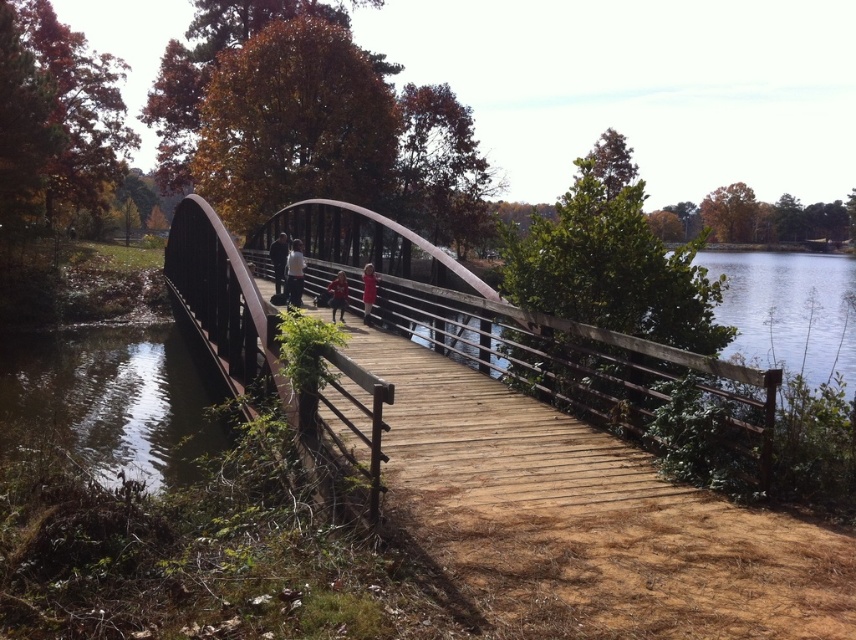
Question: Which point is closer to the camera?

Choices:
 (A) (587, 454)
 (B) (637, 380)

Answer: (A)

Question: Does wooden bridge at center appear on the left side of rusty metal bridge at center?

Choices:
 (A) yes
 (B) no

Answer: (B)

Question: Is wooden bridge at center smaller than rusty metal bridge at center?

Choices:
 (A) yes
 (B) no

Answer: (A)

Question: Which of the following is the farthest from the observer?

Choices:
 (A) (533, 417)
 (B) (485, 307)

Answer: (B)

Question: In this image, where is wooden bridge at center located relative to rusty metal bridge at center?

Choices:
 (A) left
 (B) right

Answer: (B)

Question: Among these points, which one is farthest from the camera?

Choices:
 (A) (545, 467)
 (B) (635, 406)

Answer: (B)